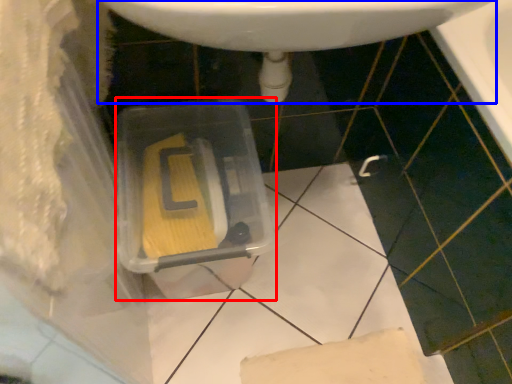
Question: Which of the following is the closest to the observer, storage box (highlighted by a red box) or sink (highlighted by a blue box)?

Choices:
 (A) storage box
 (B) sink

Answer: (B)